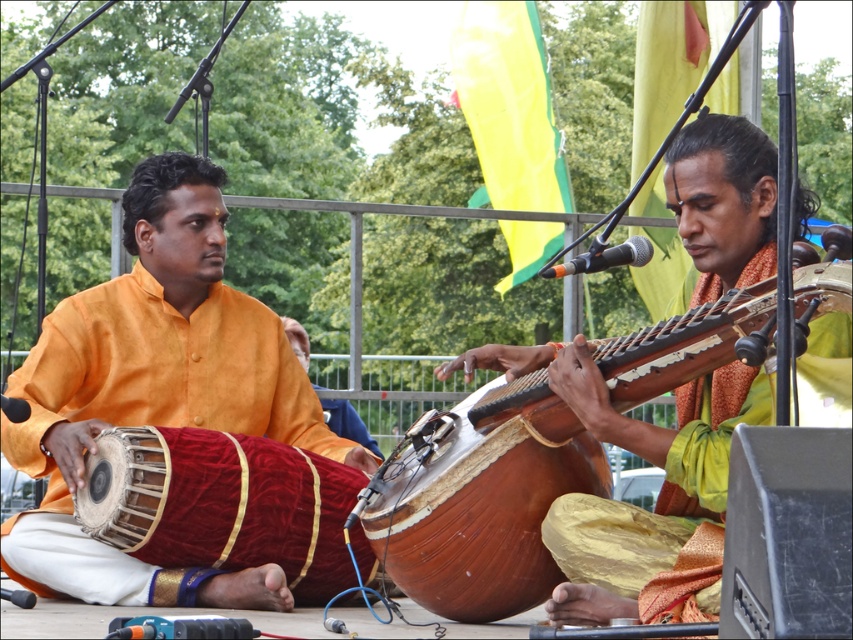
Can you confirm if matte orange shirt at left is positioned to the left of wooden acoustic guitar at center?

Indeed, matte orange shirt at left is positioned on the left side of wooden acoustic guitar at center.

Can you confirm if matte orange shirt at left is taller than wooden acoustic guitar at center?

Correct, matte orange shirt at left is much taller as wooden acoustic guitar at center.

Is point (165, 220) farther from viewer compared to point (660, 356)?

Yes.

The height and width of the screenshot is (640, 853). I want to click on matte orange shirt at left, so click(x=155, y=392).

Does matte orange shirt at left have a larger size compared to orange silk shirt at center?

Indeed, matte orange shirt at left has a larger size compared to orange silk shirt at center.

Is matte orange shirt at left smaller than orange silk shirt at center?

No.

Identify the location of matte orange shirt at left. The height and width of the screenshot is (640, 853). (155, 392).

Does matte orange shirt at left have a greater height compared to wooden drum at center?

Yes, matte orange shirt at left is taller than wooden drum at center.

Is matte orange shirt at left further to camera compared to wooden drum at center?

Yes.

Who is more forward, (270, 412) or (550, 452)?

Positioned in front is point (550, 452).

You are a GUI agent. You are given a task and a screenshot of the screen. Output one action in this format:
    pyautogui.click(x=<x>, y=<y>)
    Task: Click on the matte orange shirt at left
    
    Given the screenshot: What is the action you would take?
    pyautogui.click(x=155, y=392)